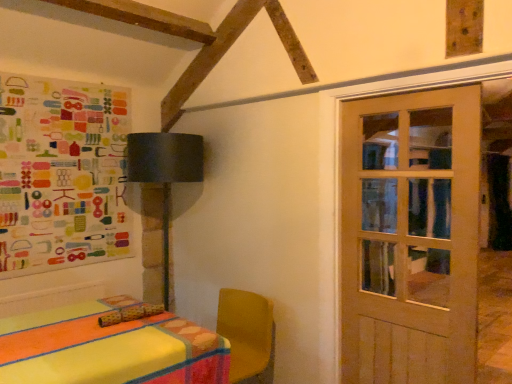
Question: Are colorful paper collage at upper left and matte black lampshade at upper left located far from each other?

Choices:
 (A) yes
 (B) no

Answer: (B)

Question: Does colorful paper collage at upper left lie in front of matte black lampshade at upper left?

Choices:
 (A) no
 (B) yes

Answer: (B)

Question: Is colorful paper collage at upper left at the left side of matte black lampshade at upper left?

Choices:
 (A) no
 (B) yes

Answer: (B)

Question: Considering the relative sizes of colorful paper collage at upper left and matte black lampshade at upper left in the image provided, is colorful paper collage at upper left smaller than matte black lampshade at upper left?

Choices:
 (A) no
 (B) yes

Answer: (B)

Question: Can you confirm if colorful paper collage at upper left is wider than matte black lampshade at upper left?

Choices:
 (A) yes
 (B) no

Answer: (B)

Question: Is colorful paper collage at upper left touching matte black lampshade at upper left?

Choices:
 (A) no
 (B) yes

Answer: (A)

Question: Considering the relative sizes of matte black lampshade at upper left and colorful paper collage at upper left in the image provided, is matte black lampshade at upper left bigger than colorful paper collage at upper left?

Choices:
 (A) no
 (B) yes

Answer: (B)

Question: From a real-world perspective, is matte black lampshade at upper left beneath colorful paper collage at upper left?

Choices:
 (A) yes
 (B) no

Answer: (A)

Question: Is matte black lampshade at upper left positioned behind colorful paper collage at upper left?

Choices:
 (A) yes
 (B) no

Answer: (A)

Question: From a real-world perspective, is matte black lampshade at upper left over colorful paper collage at upper left?

Choices:
 (A) yes
 (B) no

Answer: (B)

Question: Considering the relative positions of matte black lampshade at upper left and colorful paper collage at upper left in the image provided, is matte black lampshade at upper left to the left of colorful paper collage at upper left from the viewer's perspective?

Choices:
 (A) yes
 (B) no

Answer: (B)

Question: Considering the relative sizes of matte black lampshade at upper left and colorful paper collage at upper left in the image provided, is matte black lampshade at upper left shorter than colorful paper collage at upper left?

Choices:
 (A) no
 (B) yes

Answer: (A)

Question: Is wooden door at right positioned in front of colorful paper collage at upper left?

Choices:
 (A) yes
 (B) no

Answer: (A)